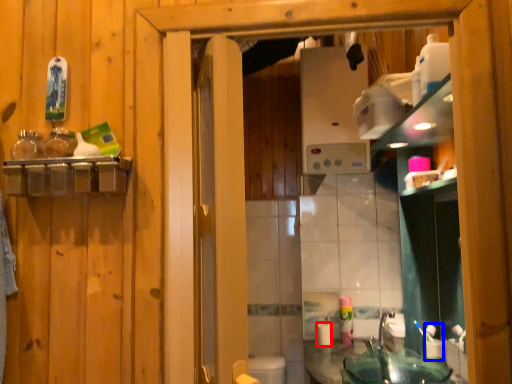
Question: Which object appears closest to the camera in this image, toilet paper (highlighted by a red box) or toiletry (highlighted by a blue box)?

Choices:
 (A) toilet paper
 (B) toiletry

Answer: (B)